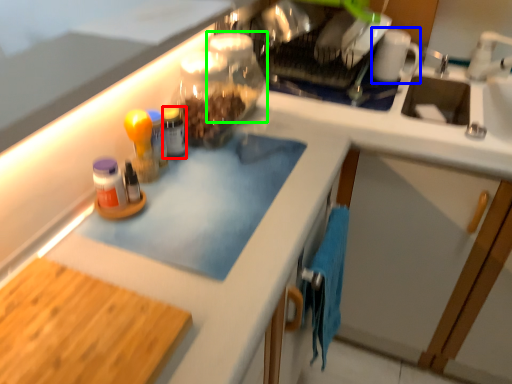
Question: Based on their relative distances, which object is farther from bottle (highlighted by a red box)? Choose from mug (highlighted by a blue box) and glass jar (highlighted by a green box).

Choices:
 (A) mug
 (B) glass jar

Answer: (A)